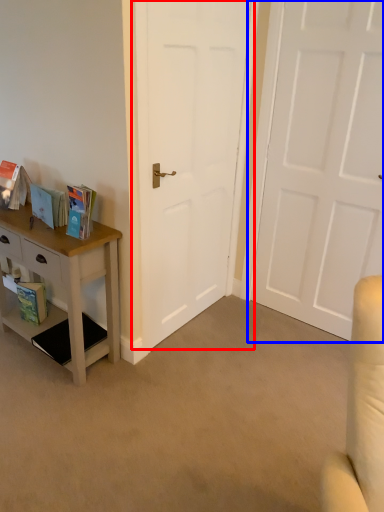
Question: Which point is closer to the camera, door (highlighted by a red box) or door (highlighted by a blue box)?

Choices:
 (A) door
 (B) door

Answer: (A)